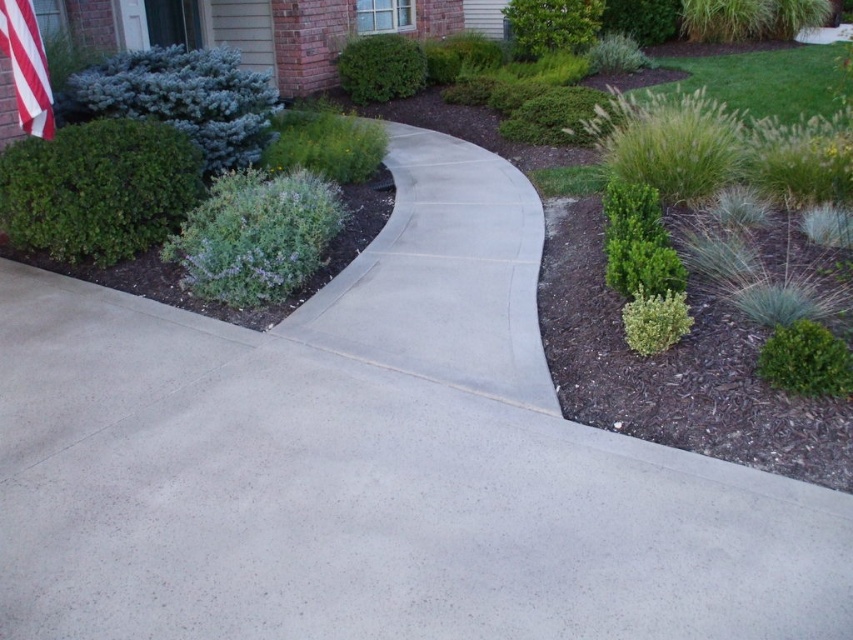
Is point (247, 141) positioned behind point (4, 19)?

Yes, point (247, 141) is farther from viewer.

Is point (260, 140) closer to viewer compared to point (6, 10)?

That is False.

The image size is (853, 640). I want to click on blue-green textured shrub at upper left, so click(183, 99).

You are a GUI agent. You are given a task and a screenshot of the screen. Output one action in this format:
    pyautogui.click(x=<x>, y=<y>)
    Task: Click on the blue-green textured shrub at upper left
    
    Given the screenshot: What is the action you would take?
    (183, 99)

Does blue-green textured shrub at upper left have a smaller size compared to green leafy shrub at upper center?

No.

How distant is blue-green textured shrub at upper left from green leafy shrub at upper center?

blue-green textured shrub at upper left and green leafy shrub at upper center are 6.62 meters apart.

Find the location of a particular element. Image resolution: width=853 pixels, height=640 pixels. blue-green textured shrub at upper left is located at coordinates (183, 99).

At what (x,y) coordinates should I click in order to perform the action: click on blue-green textured shrub at upper left. Please return your answer as a coordinate pair (x, y). The image size is (853, 640). Looking at the image, I should click on click(183, 99).

Which is below, green matte shrub at upper left or green leafy shrub at upper center?

green matte shrub at upper left is lower down.

Which of these two, green matte shrub at upper left or green leafy shrub at upper center, stands shorter?

green leafy shrub at upper center is shorter.

Who is more forward, (144,284) or (531,29)?

Point (144,284) is more forward.

You are a GUI agent. You are given a task and a screenshot of the screen. Output one action in this format:
    pyautogui.click(x=<x>, y=<y>)
    Task: Click on the green matte shrub at upper left
    This screenshot has width=853, height=640.
    Given the screenshot: What is the action you would take?
    pyautogui.click(x=219, y=304)